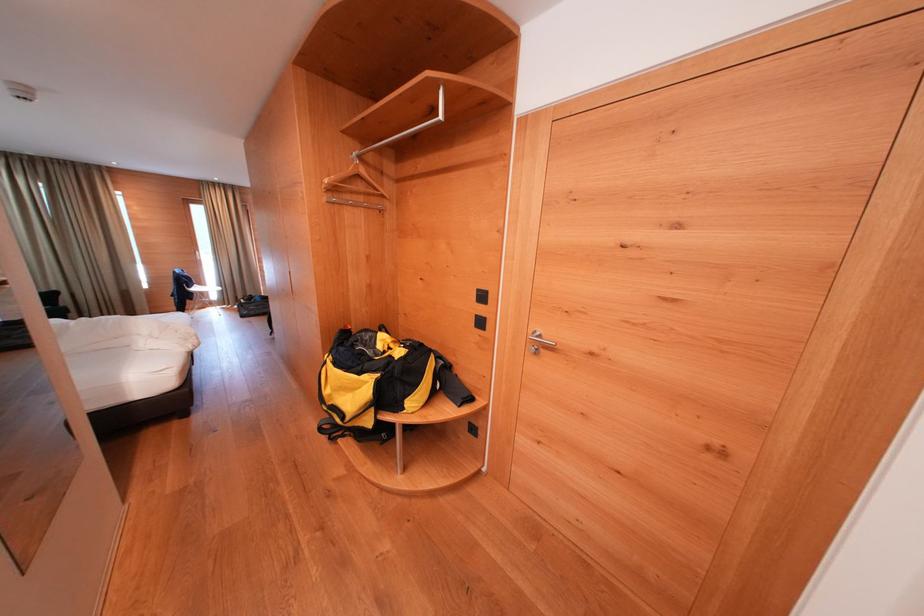
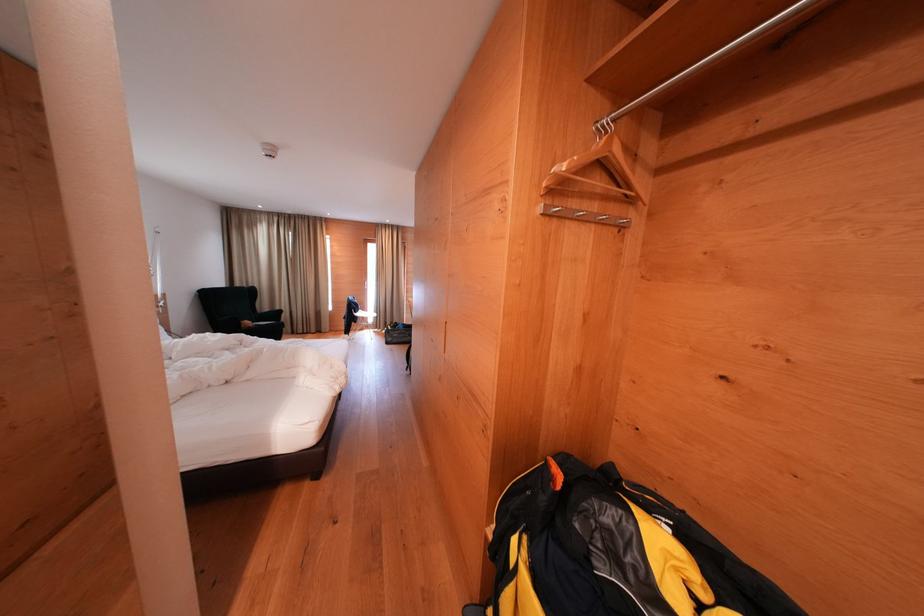
In the second image, find the point that corresponds to point 332,204 in the first image.

(546, 213)